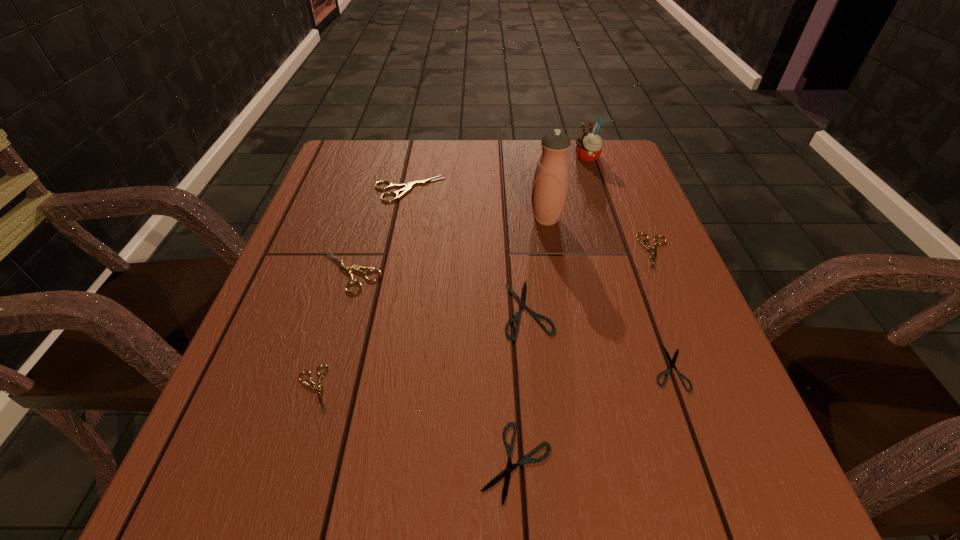
The image size is (960, 540). What are the coordinates of `blank area located on the back of the farthest shears` in the screenshot? It's located at (416, 160).

I want to click on vacant space situated 0.120m on the right of the second biggest beige shears, so click(442, 272).

Where is `blank space located on the front of the rightmost shears`? blank space located on the front of the rightmost shears is located at coordinates pos(732,430).

This screenshot has width=960, height=540. I want to click on free space located on the back of the biggest black shears, so click(x=515, y=178).

Identify the location of vacant space located 0.320m on the right of the smallest beige shears. (532, 389).

You are a GUI agent. You are given a task and a screenshot of the screen. Output one action in this format:
    pyautogui.click(x=<x>, y=<y>)
    Task: Click on the free location located on the back of the second smallest black shears
    This screenshot has height=540, width=960.
    Given the screenshot: What is the action you would take?
    click(x=510, y=348)

Locate an element on the screen. This screenshot has width=960, height=540. blank space located 0.130m on the back of the smallest black shears is located at coordinates (642, 293).

Locate an element on the screen. The image size is (960, 540). muffin that is at the far edge is located at coordinates (589, 145).

This screenshot has height=540, width=960. I want to click on shears that is at the far edge, so click(407, 187).

This screenshot has width=960, height=540. In order to click on object at the near edge in this screenshot , I will do `click(507, 472)`.